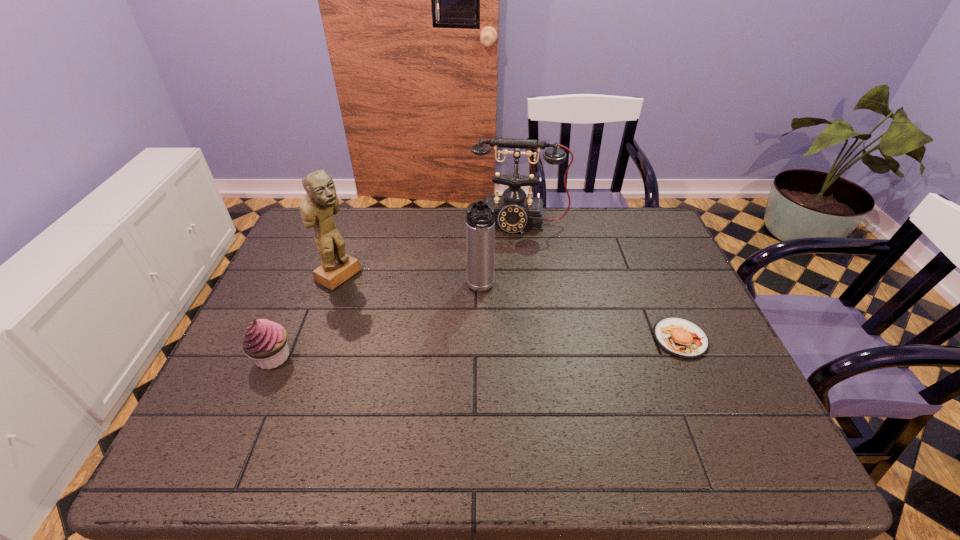
Locate an element on the screen. The width and height of the screenshot is (960, 540). object present at the right edge is located at coordinates (680, 337).

Locate an element on the screen. free space at the far edge is located at coordinates (564, 233).

This screenshot has width=960, height=540. In the image, there is a desktop. What are the coordinates of `vacant space at the left edge` in the screenshot? It's located at (282, 266).

Find the location of a particular element. vacant area at the right edge is located at coordinates (711, 332).

Where is `free space at the near left corner of the desktop`? free space at the near left corner of the desktop is located at coordinates 228,412.

In the image, there is a desktop. Where is `free space at the far right corner`? The image size is (960, 540). free space at the far right corner is located at coordinates (646, 217).

Where is `free space between the thermos bottle and the telephone`? The width and height of the screenshot is (960, 540). free space between the thermos bottle and the telephone is located at coordinates (500, 255).

Image resolution: width=960 pixels, height=540 pixels. I want to click on free spot between the cupcake and the thermos bottle, so click(x=377, y=322).

At what (x,y) coordinates should I click in order to perform the action: click on unoccupied area between the figurine and the farthest object. Please return your answer as a coordinate pair (x, y). The width and height of the screenshot is (960, 540). Looking at the image, I should click on (429, 249).

At what (x,y) coordinates should I click in order to perform the action: click on vacant region between the shortest object and the farthest object. Please return your answer as a coordinate pair (x, y). Looking at the image, I should click on (600, 280).